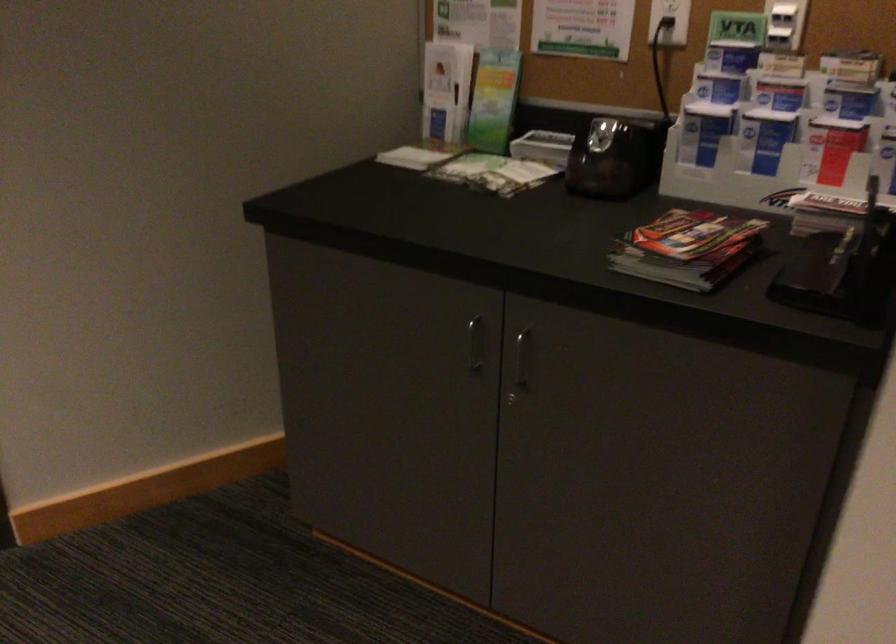
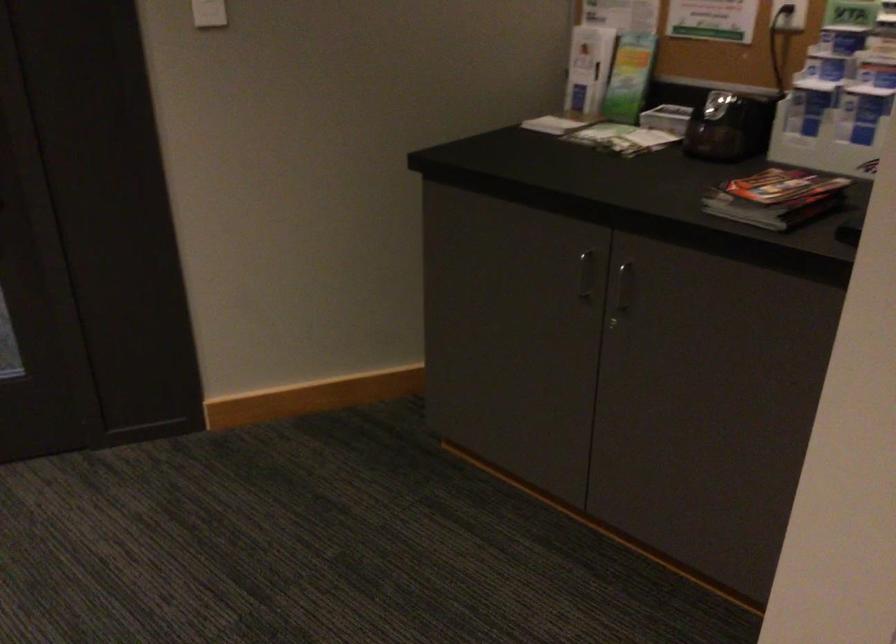
Question: The first image is from the beginning of the video and the second image is from the end. How did the camera likely rotate when shooting the video?

Choices:
 (A) Left
 (B) Right
 (C) Up
 (D) Down

Answer: (A)